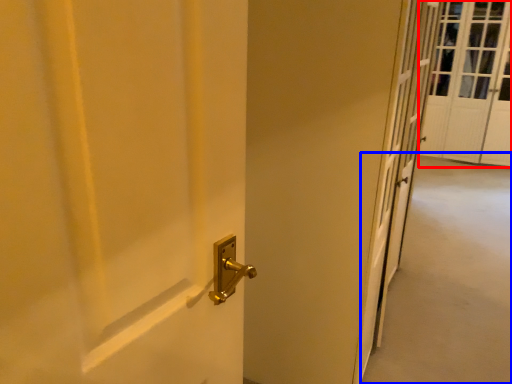
Question: Which object is further to the camera taking this photo, screen door (highlighted by a red box) or corridor (highlighted by a blue box)?

Choices:
 (A) screen door
 (B) corridor

Answer: (A)